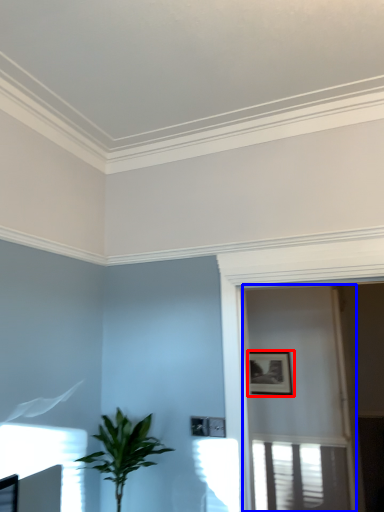
Question: Which point is further to the camera, picture frame (highlighted by a red box) or screen door (highlighted by a blue box)?

Choices:
 (A) picture frame
 (B) screen door

Answer: (A)